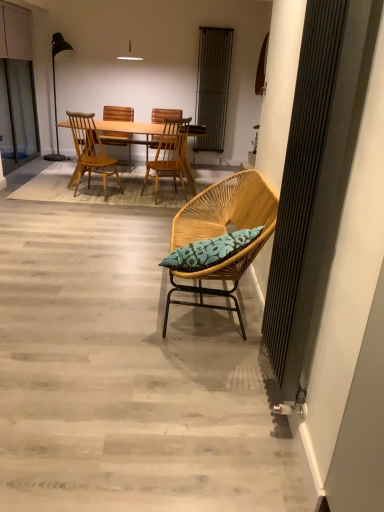
What are the coordinates of `vacant area that is in front of woven wood chair with blue cushion at center, marked as the 1th chair in a front-to-back arrangement` in the screenshot? It's located at pos(146,404).